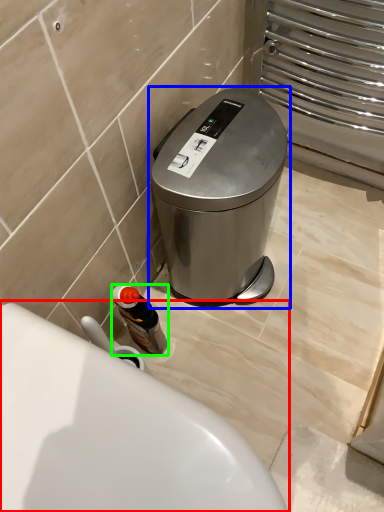
Question: Which object is positioned closest to toilet (highlighted by a red box)? Select from waste container (highlighted by a blue box) and bottle (highlighted by a green box).

Choices:
 (A) waste container
 (B) bottle

Answer: (B)